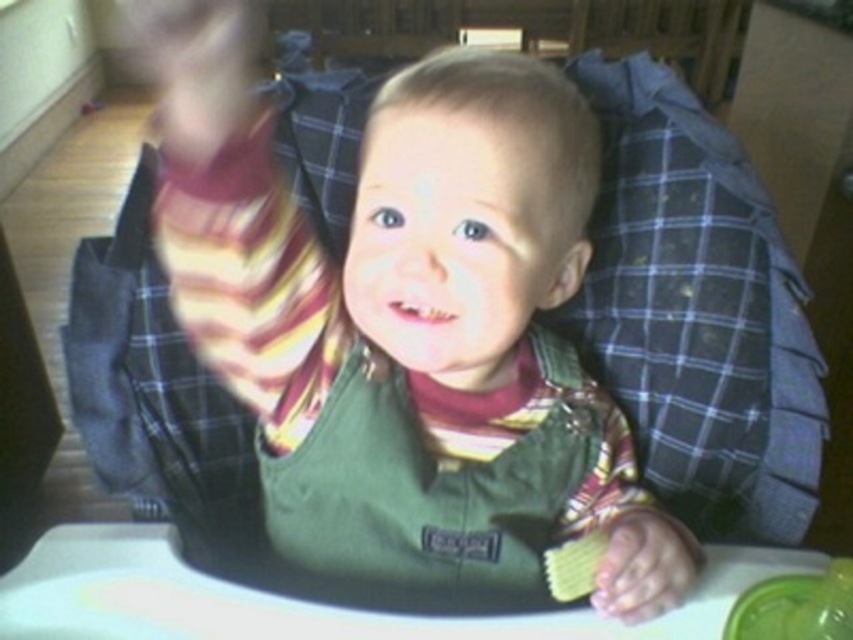
Question: Which point is closer to the camera?

Choices:
 (A) green fabric bib at center
 (B) smooth skin hand at center

Answer: (A)

Question: Can you confirm if green fabric bib at center is wider than smooth skin hand at center?

Choices:
 (A) no
 (B) yes

Answer: (B)

Question: Which of the following is the closest to the observer?

Choices:
 (A) (693, 577)
 (B) (537, 579)

Answer: (A)

Question: Does green fabric bib at center appear on the left side of smooth skin hand at center?

Choices:
 (A) no
 (B) yes

Answer: (B)

Question: Can you confirm if green fabric bib at center is positioned to the right of smooth skin hand at center?

Choices:
 (A) no
 (B) yes

Answer: (A)